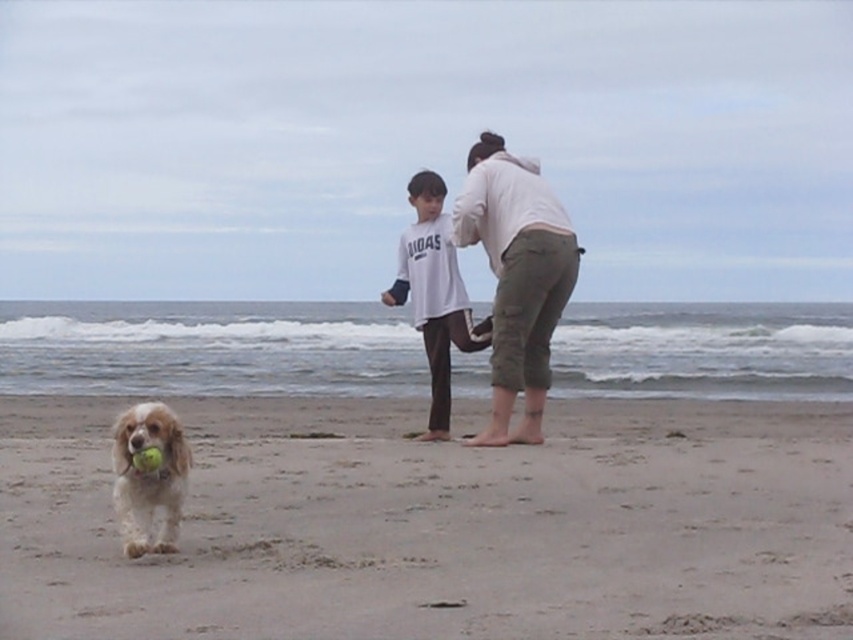
You are planning to build a sandcastle on the beach. Given the smooth beige sand at center and the golden fur dog at lower left are present in the scene, which area would be more suitable for building the sandcastle and why?

The smooth beige sand at center is more suitable for building a sandcastle because its width surpasses that of the golden fur dog at lower left, providing a larger and more stable area for construction.

Looking at this image, you are a drone operator trying to capture a photo of the golden fur dog at lower left and the smooth beige sand at center. From the drone camera view, which object is closer to the camera?

The golden fur dog at lower left is closer to the camera because the smooth beige sand at center is positioned under it, meaning the dog is in front of the sand.

You are a photographer trying to capture a group photo of the two people in the center of the beach scene. You need to ensure both the white cotton hoodie at center and the white cotton shirt at center are clearly visible. Which clothing item should you focus on first to ensure it doesn

The white cotton hoodie at center has a smaller size compared to the white cotton shirt at center. Therefore, you should focus on the white cotton hoodie at center first to ensure its details are captured clearly before adjusting for the larger white cotton shirt at center.